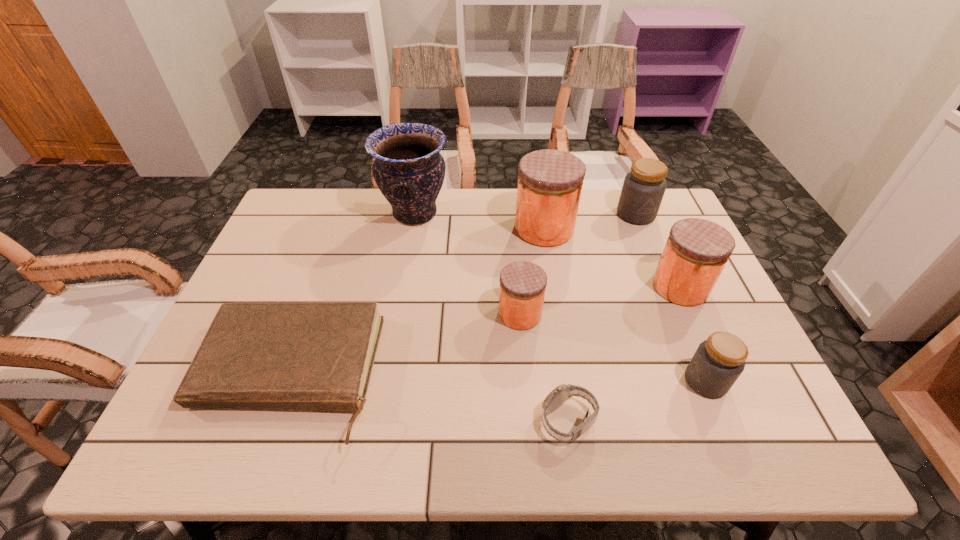
Where is `the second closest jar to the farther gray jar`? the second closest jar to the farther gray jar is located at coordinates (697, 250).

Locate which jar is the second closest to the smallest orange jar. Please provide its 2D coordinates. Your answer should be formatted as a tuple, i.e. [(x, y)], where the tuple contains the x and y coordinates of a point satisfying the conditions above.

[(697, 250)]

Select which orange jar is the closest to the smallest orange jar. Please provide its 2D coordinates. Your answer should be formatted as a tuple, i.e. [(x, y)], where the tuple contains the x and y coordinates of a point satisfying the conditions above.

[(550, 182)]

The image size is (960, 540). What are the coordinates of `orange jar that is the second closest to the second shortest object` in the screenshot? It's located at (697, 250).

Where is `free space that satisfies the following two spatial constraints: 1. on the front handle of the pottery; 2. on the left side of the farthest orange jar`? free space that satisfies the following two spatial constraints: 1. on the front handle of the pottery; 2. on the left side of the farthest orange jar is located at coordinates (412, 228).

Where is `vacant space that satisfies the following two spatial constraints: 1. on the front handle of the pottery; 2. on the left side of the second smallest orange jar`? This screenshot has width=960, height=540. vacant space that satisfies the following two spatial constraints: 1. on the front handle of the pottery; 2. on the left side of the second smallest orange jar is located at coordinates (402, 287).

The image size is (960, 540). Identify the location of vacant point that satisfies the following two spatial constraints: 1. on the front handle of the biggest orange jar; 2. on the left side of the pottery. (412, 228).

Find the location of a particular element. vacant space that satisfies the following two spatial constraints: 1. on the front handle of the pottery; 2. on the back side of the smallest orange jar is located at coordinates (397, 314).